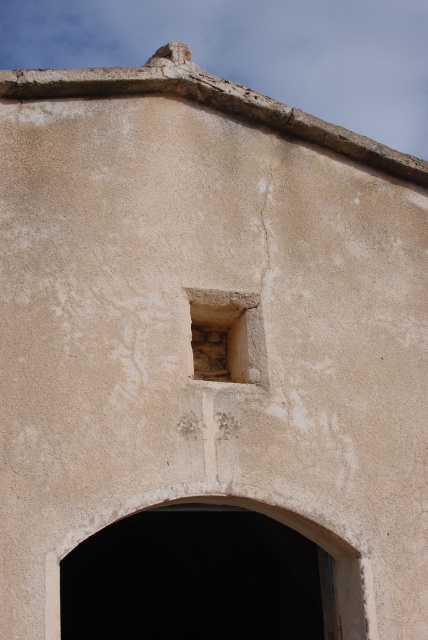
Question: Can you confirm if transparent glass window at upper center is smaller than rough stone window at upper center?

Choices:
 (A) yes
 (B) no

Answer: (B)

Question: Is transparent glass window at upper center positioned at the back of rough stone window at upper center?

Choices:
 (A) yes
 (B) no

Answer: (B)

Question: Which point is farther to the camera?

Choices:
 (A) rough stone window at upper center
 (B) transparent glass window at upper center

Answer: (A)

Question: Can you confirm if transparent glass window at upper center is positioned below rough stone window at upper center?

Choices:
 (A) yes
 (B) no

Answer: (A)